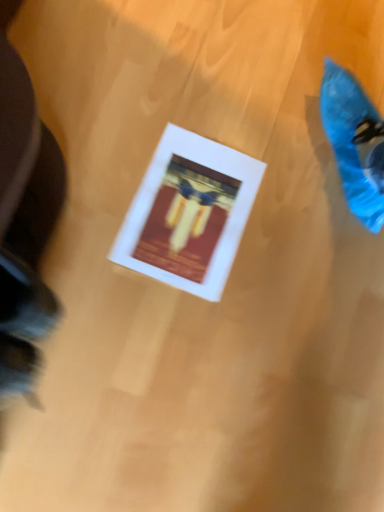
The width and height of the screenshot is (384, 512). I want to click on vacant area that is in front of white matte picture frame at center, so click(114, 296).